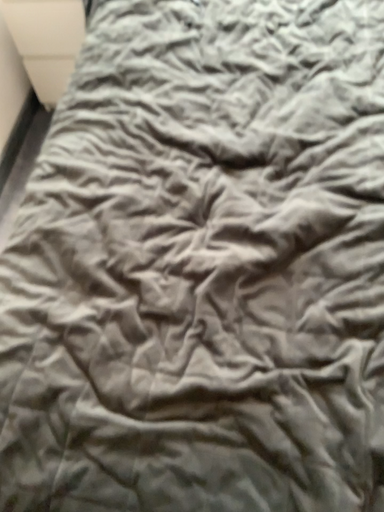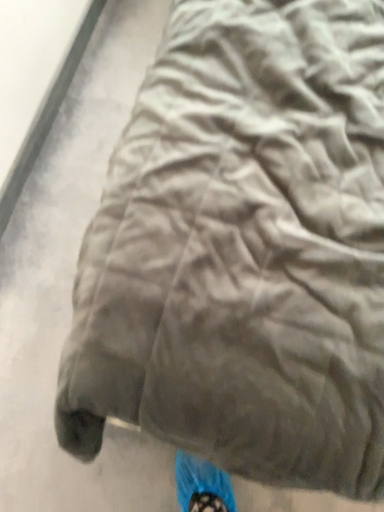
Question: How did the camera likely rotate when shooting the video?

Choices:
 (A) rotated downward
 (B) rotated upward

Answer: (A)